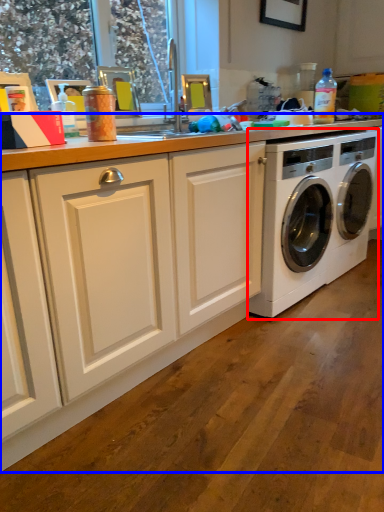
Question: Which of the following is the farthest to the observer, washing machine (highlighted by a red box) or countertop (highlighted by a blue box)?

Choices:
 (A) washing machine
 (B) countertop

Answer: (A)